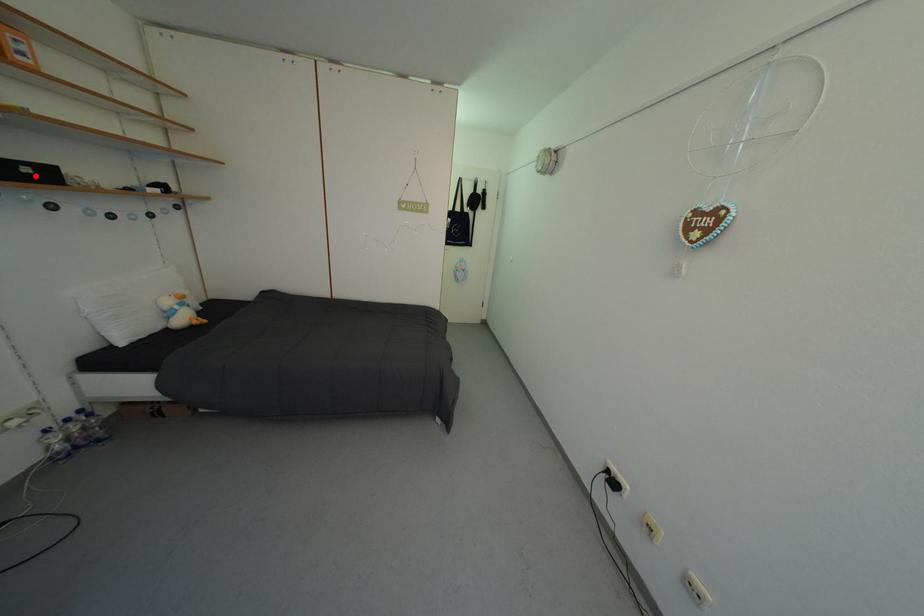
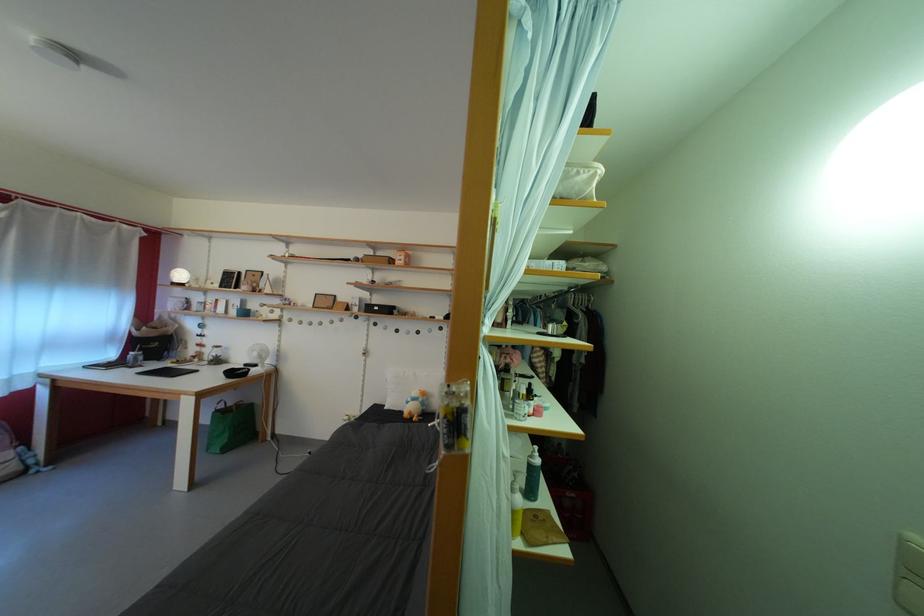
Where in the second image is the point corresponding to the highlighted location from the first image?

(384, 314)